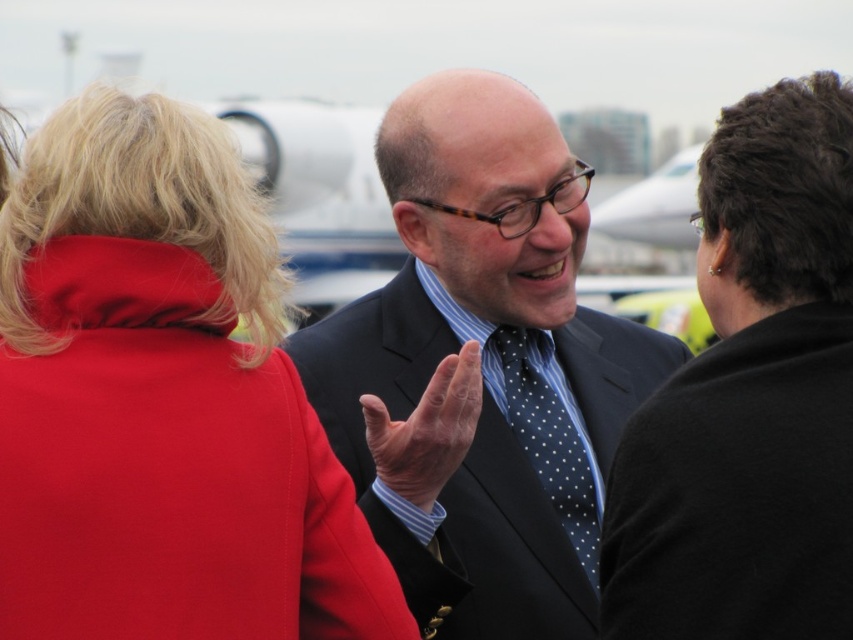
Question: Which object is closer to the camera taking this photo?

Choices:
 (A) blue dotted fabric tie at center
 (B) matte red coat at left

Answer: (B)

Question: Among these objects, which one is nearest to the camera?

Choices:
 (A) blue dotted fabric tie at center
 (B) black woolen jacket at upper right
 (C) smooth black hand at center
 (D) matte black suit at center

Answer: (B)

Question: Does blue dotted fabric tie at center appear on the right side of smooth black hand at center?

Choices:
 (A) no
 (B) yes

Answer: (B)

Question: Does matte red coat at left have a greater width compared to blue dotted fabric tie at center?

Choices:
 (A) no
 (B) yes

Answer: (B)

Question: Which point is farther from the camera taking this photo?

Choices:
 (A) (601, 488)
 (B) (149, 282)
 (C) (714, 524)
 (D) (554, 474)

Answer: (A)

Question: Does black woolen jacket at upper right have a greater width compared to blue dotted fabric tie at center?

Choices:
 (A) no
 (B) yes

Answer: (B)